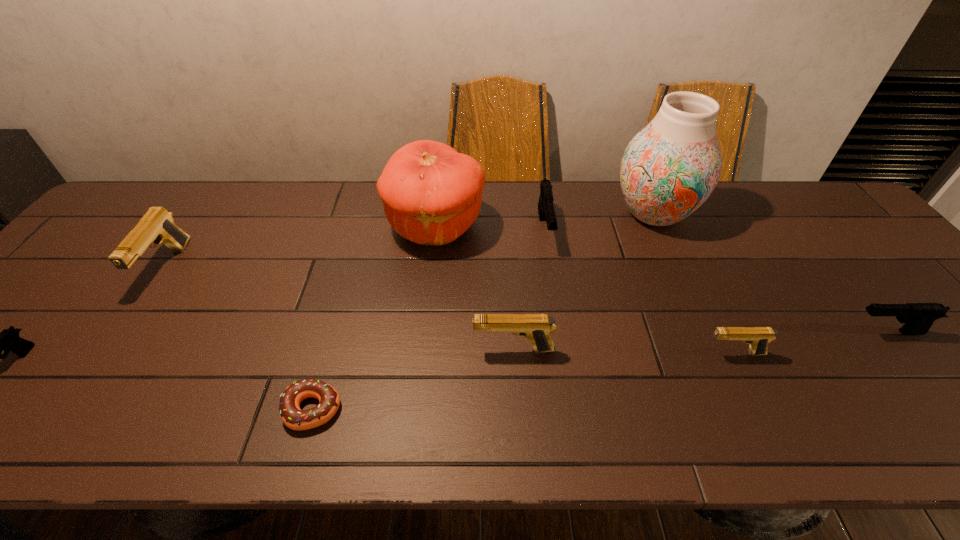
I want to click on the second pistol from right to left, so click(x=758, y=337).

At what (x,y) coordinates should I click in order to perform the action: click on the smallest tan pistol. Please return your answer as a coordinate pair (x, y). This screenshot has height=540, width=960. Looking at the image, I should click on (758, 337).

Locate an element on the screen. This screenshot has width=960, height=540. the third object from left to right is located at coordinates (293, 417).

Find the location of `brown doughnut`. brown doughnut is located at coordinates (293, 417).

Identify the location of blank space located on the right of the tallest object. This screenshot has height=540, width=960. (x=773, y=214).

Where is `free space located on the front of the eighth shortest object`? This screenshot has height=540, width=960. free space located on the front of the eighth shortest object is located at coordinates (421, 361).

Locate an element on the screen. This screenshot has width=960, height=540. vacant space located 0.190m at the barrel of the leftmost tan pistol is located at coordinates (100, 365).

Image resolution: width=960 pixels, height=540 pixels. Find the location of `blank space located on the front-facing side of the second black pistol from right to left`. blank space located on the front-facing side of the second black pistol from right to left is located at coordinates (559, 320).

Image resolution: width=960 pixels, height=540 pixels. I want to click on free point located at the barrel of the second smallest tan pistol, so click(420, 349).

Where is `free point located at the barrel of the second smallest tan pistol`? The image size is (960, 540). free point located at the barrel of the second smallest tan pistol is located at coordinates (295, 349).